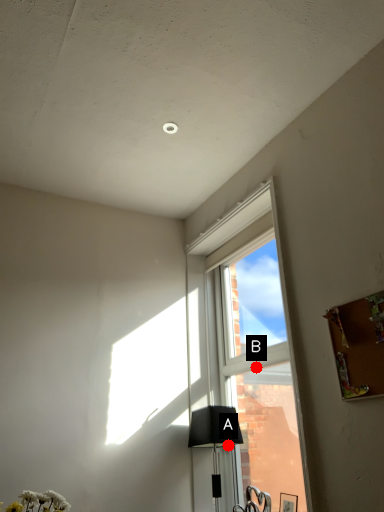
Question: Two points are circled on the image, labeled by A and B beside each circle. Which point appears closest to the camera in this image?

Choices:
 (A) A is closer
 (B) B is closer

Answer: (B)